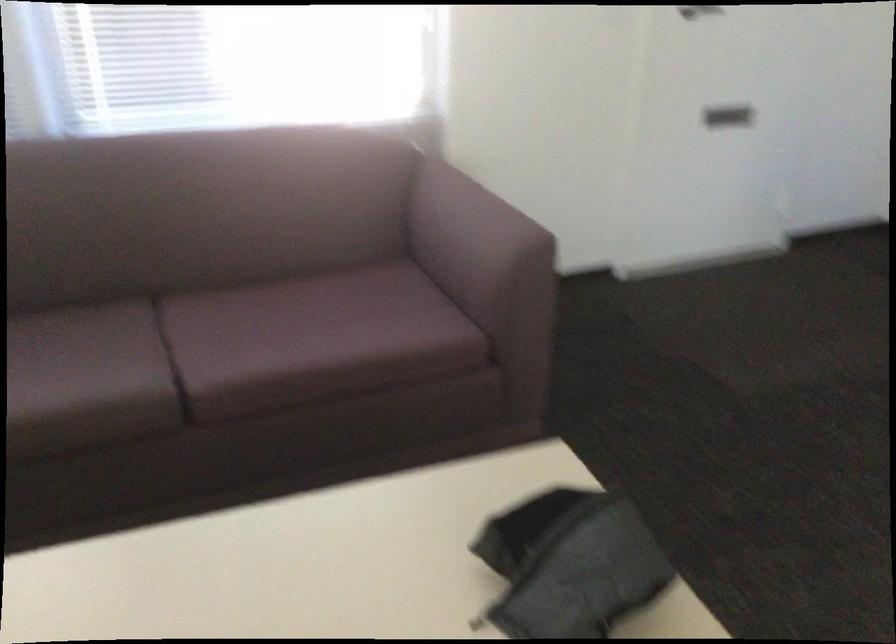
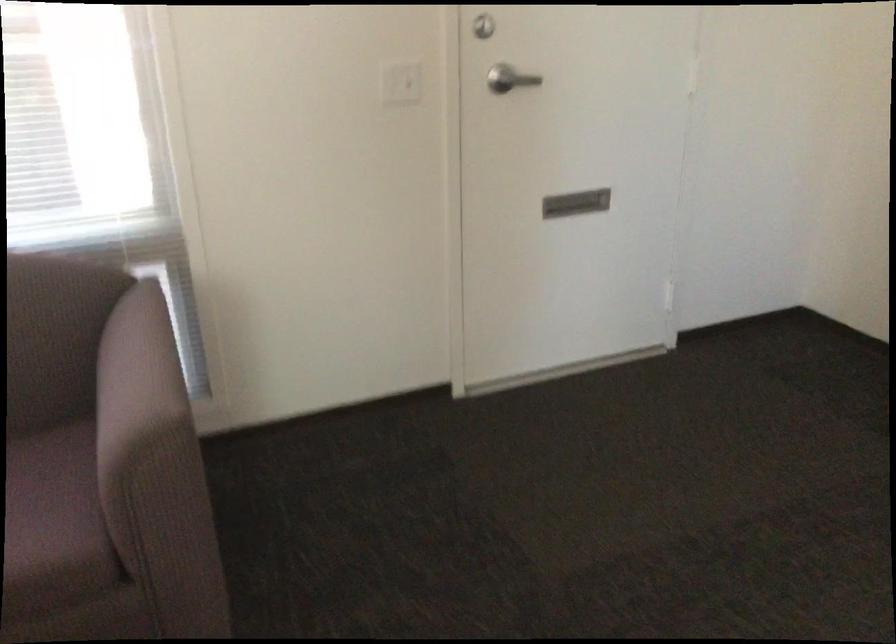
Where in the second image is the point corresponding to (x=428, y=317) from the first image?

(53, 520)